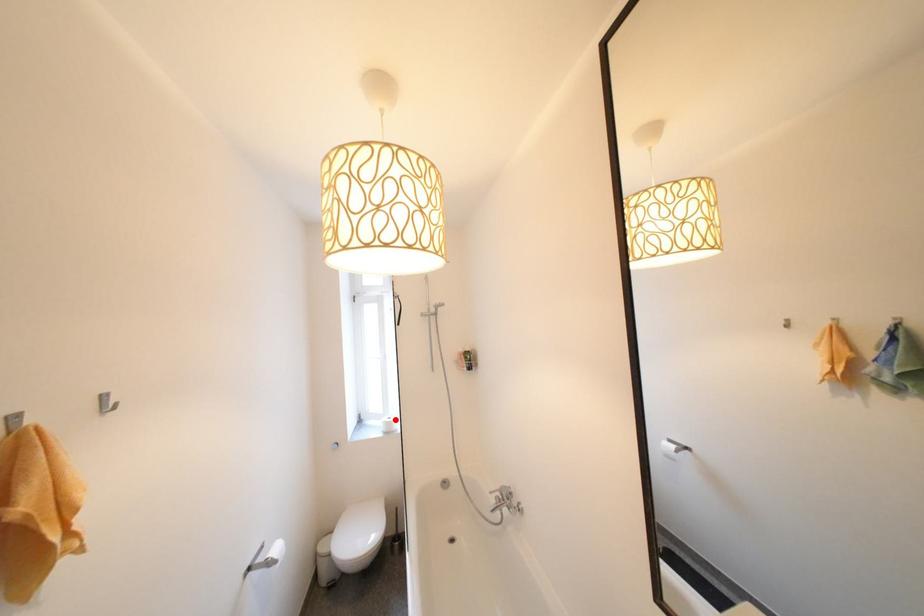
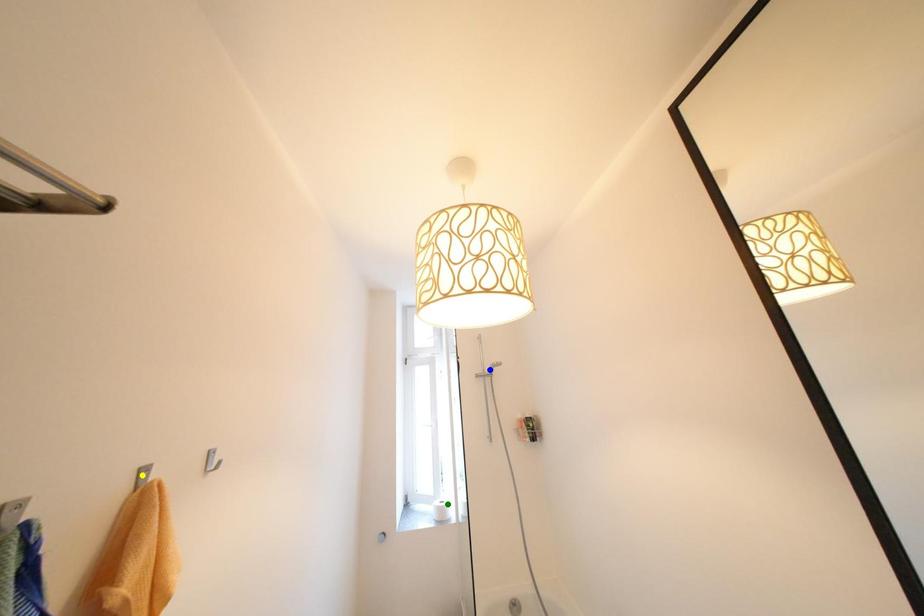
Question: I am providing you with two images of the same scene from different viewpoints. A red point is marked on the first image. You are given multiple points on the second image. Which point in image 2 is actually the same real-world point as the red point in image 1?

Choices:
 (A) yellow point
 (B) green point
 (C) blue point

Answer: (B)